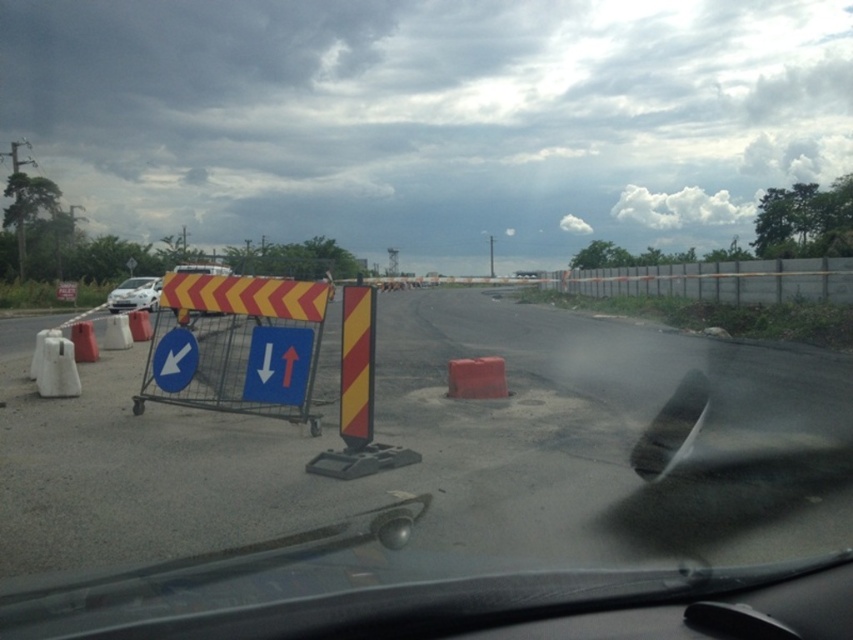
Question: Is transparent glass windshield at center smaller than concrete fence at upper center?

Choices:
 (A) yes
 (B) no

Answer: (A)

Question: Is yellow/red striped shopping cart at left bigger than white matte car at left?

Choices:
 (A) no
 (B) yes

Answer: (B)

Question: Is transparent glass windshield at center to the left of blue plastic arrow at left from the viewer's perspective?

Choices:
 (A) yes
 (B) no

Answer: (B)

Question: Which point is farther to the camera?

Choices:
 (A) (134, 282)
 (B) (166, 369)
 (C) (732, 262)

Answer: (A)

Question: Which point is closer to the camera taking this photo?

Choices:
 (A) (233, 333)
 (B) (120, 298)
 (C) (257, 376)

Answer: (C)

Question: Which point appears farthest from the camera in this image?

Choices:
 (A) (180, 349)
 (B) (262, 330)
 (C) (398, 353)
 (D) (625, 273)

Answer: (D)